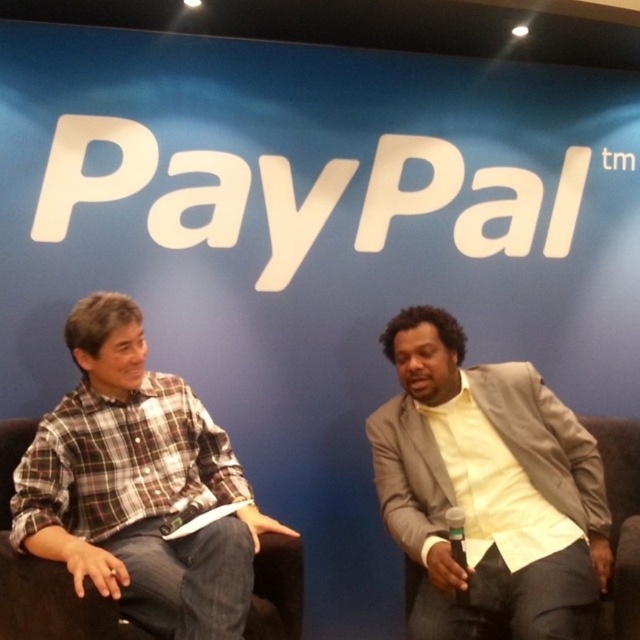
Is light beige textured blazer at right closer to the viewer compared to plaid cotton shirt at left?

No, light beige textured blazer at right is behind plaid cotton shirt at left.

Can you confirm if light beige textured blazer at right is bigger than plaid cotton shirt at left?

Actually, light beige textured blazer at right might be smaller than plaid cotton shirt at left.

Is point (579, 499) closer to camera compared to point (140, 401)?

Yes, point (579, 499) is in front of point (140, 401).

This screenshot has height=640, width=640. I want to click on light beige textured blazer at right, so click(488, 484).